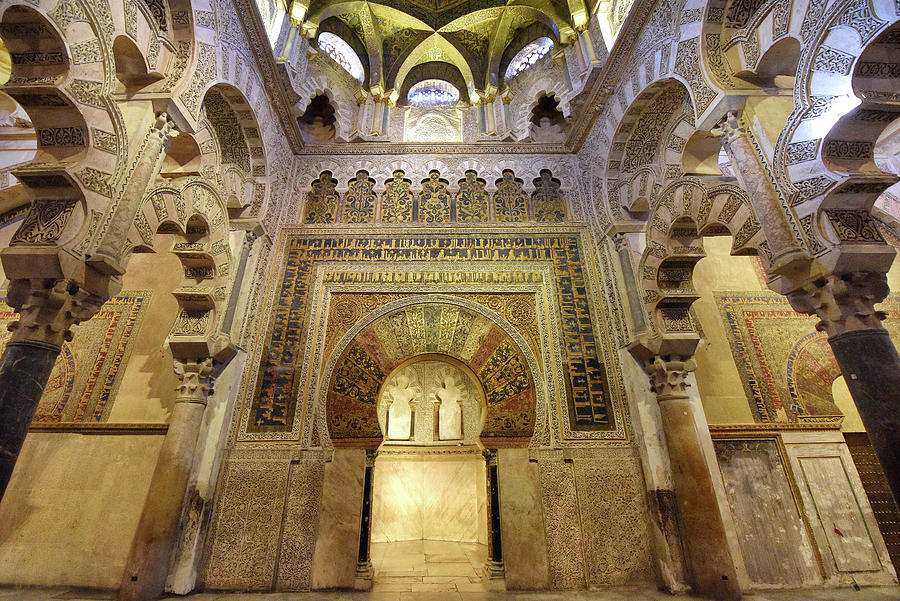
Identify the location of stainglass windows. This screenshot has width=900, height=601. (421, 92), (328, 53), (523, 53).